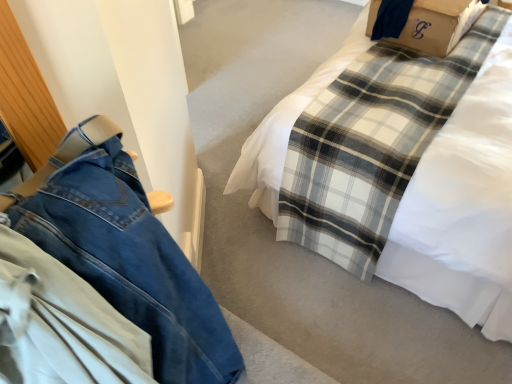
Question: Is white plaid blanket at center inside the boundaries of denim pants at left, or outside?

Choices:
 (A) outside
 (B) inside

Answer: (A)

Question: Considering the relative positions of white plaid blanket at center and denim pants at left in the image provided, is white plaid blanket at center to the left or to the right of denim pants at left?

Choices:
 (A) left
 (B) right

Answer: (B)

Question: Considering the real-world distances, which object is farthest from the denim pants at left?

Choices:
 (A) brown cardboard box at upper right
 (B) white plaid blanket at center

Answer: (A)

Question: Which of these objects is positioned closest to the white plaid blanket at center?

Choices:
 (A) denim pants at left
 (B) brown cardboard box at upper right

Answer: (B)